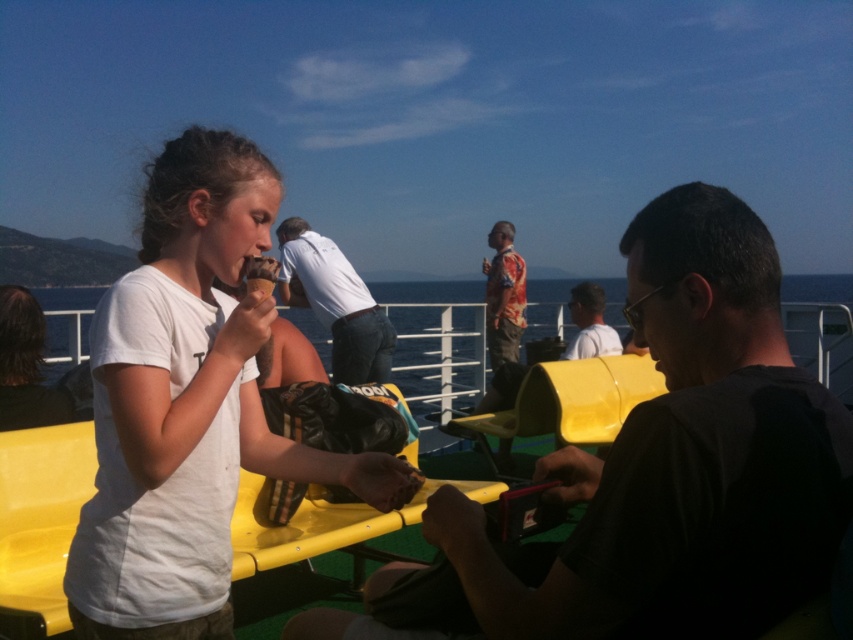
Can you confirm if printed fabric shirt at center is thinner than matte brown ice cream cone at center?

No, printed fabric shirt at center is not thinner than matte brown ice cream cone at center.

Which is more to the right, printed fabric shirt at center or matte brown ice cream cone at center?

printed fabric shirt at center

The image size is (853, 640). I want to click on printed fabric shirt at center, so click(x=503, y=296).

What are the coordinates of `printed fabric shirt at center` in the screenshot? It's located at (503, 296).

Between point (335, 314) and point (271, 262), which one is positioned behind?

Positioned behind is point (335, 314).

Is white cotton shirt at center below matte brown ice cream cone at center?

No, white cotton shirt at center is not below matte brown ice cream cone at center.

Identify the location of white cotton shirt at center. This screenshot has height=640, width=853. (335, 301).

In the scene shown: Which is above, light brown leather jacket at center or matte brown ice cream cone at center?

matte brown ice cream cone at center is higher up.

Which is more to the left, light brown leather jacket at center or matte brown ice cream cone at center?

Positioned to the left is matte brown ice cream cone at center.

Identify the location of light brown leather jacket at center. The width and height of the screenshot is (853, 640). (589, 323).

At what (x,y) coordinates should I click in order to perform the action: click on light brown leather jacket at center. Please return your answer as a coordinate pair (x, y). Image resolution: width=853 pixels, height=640 pixels. Looking at the image, I should click on (589, 323).